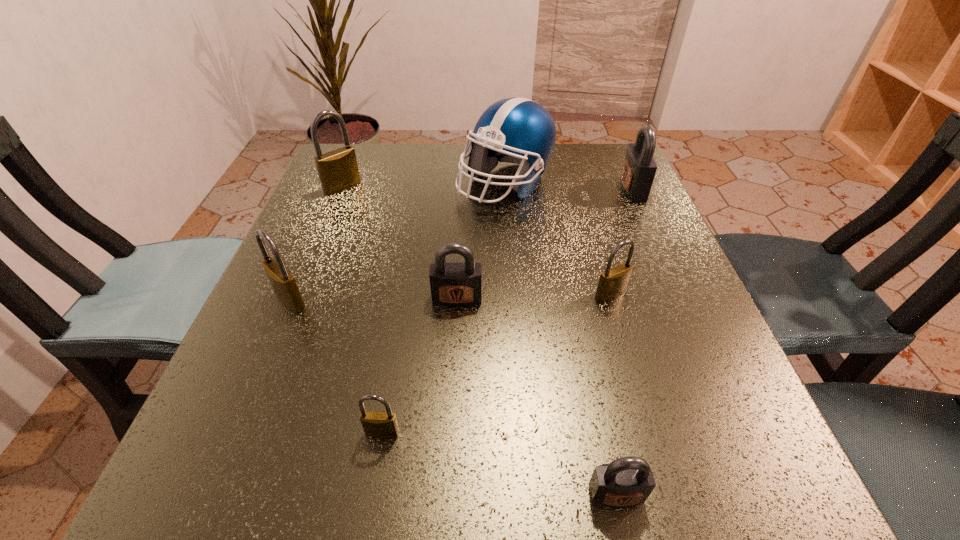
In the image, there is a desktop. In order to click on vacant space at the right edge in this screenshot , I will do `click(643, 414)`.

Identify the location of vacant space at the far left corner of the desktop. (365, 163).

The image size is (960, 540). In the image, there is a desktop. Identify the location of vacant space at the near left corner. (180, 516).

The width and height of the screenshot is (960, 540). I want to click on free space at the near right corner of the desktop, so click(657, 489).

You are a GUI agent. You are given a task and a screenshot of the screen. Output one action in this format:
    pyautogui.click(x=<x>, y=<y>)
    Task: Click on the vacant space that's between the nearest brass padlock and the third smallest brass padlock
    Image resolution: width=960 pixels, height=540 pixels.
    Given the screenshot: What is the action you would take?
    pyautogui.click(x=337, y=367)

You are a GUI agent. You are given a task and a screenshot of the screen. Output one action in this format:
    pyautogui.click(x=<x>, y=<y>)
    Task: Click on the vacant area that lies between the fifth padlock from left to right and the rightmost object
    The image size is (960, 540).
    Given the screenshot: What is the action you would take?
    pyautogui.click(x=624, y=341)

Find the location of a particular element. The height and width of the screenshot is (540, 960). free space between the football helmet and the second padlock from right to left is located at coordinates (558, 239).

Image resolution: width=960 pixels, height=540 pixels. In order to click on empty space between the second padlock from right to left and the rightmost gray padlock in this screenshot , I will do `click(621, 241)`.

Where is `vacant space in between the rightmost brass padlock and the fifth padlock from left to right`? The height and width of the screenshot is (540, 960). vacant space in between the rightmost brass padlock and the fifth padlock from left to right is located at coordinates (613, 394).

Find the location of `free space that is in between the third biggest brass padlock and the fourth padlock from right to left`. free space that is in between the third biggest brass padlock and the fourth padlock from right to left is located at coordinates (534, 296).